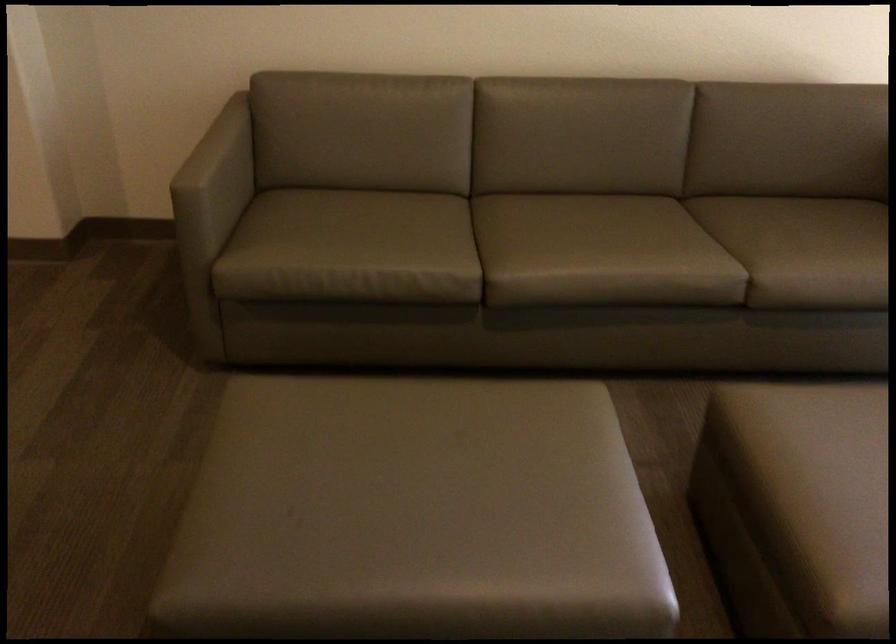
Where is `sofa armrest`? The image size is (896, 644). sofa armrest is located at coordinates (218, 144).